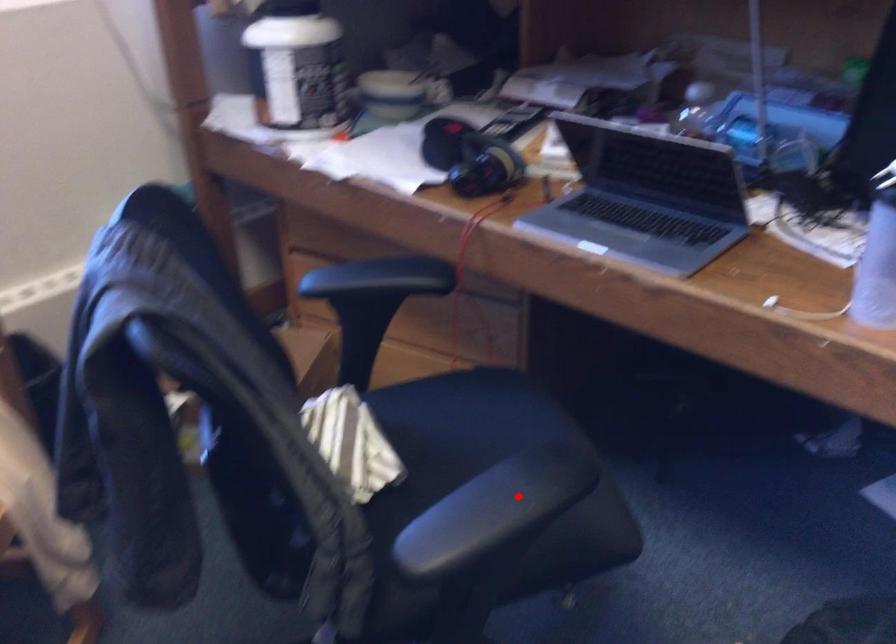
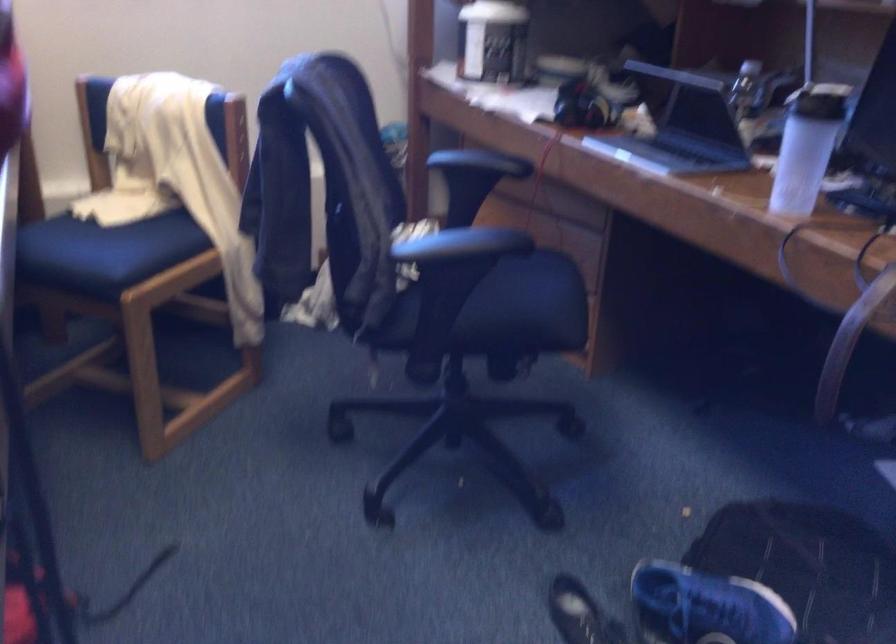
Question: I am providing you with two images of the same scene from different viewpoints. In image1, a red point is highlighted. Considering the same 3D point in image2, which of the following is correct?

Choices:
 (A) It is closer
 (B) It is farther

Answer: (B)